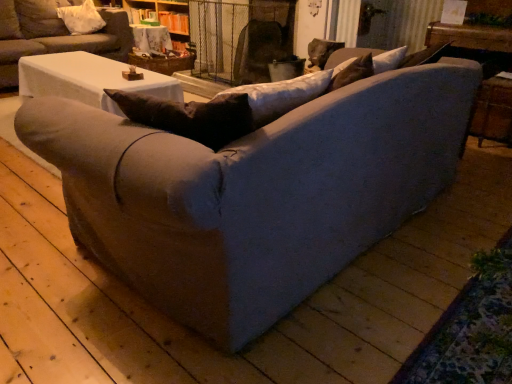
Question: Choose the correct answer: Is textured gray couch at center, which is the first studio couch in bottom-to-top order, inside white fabric pillow at upper left or outside it?

Choices:
 (A) inside
 (B) outside

Answer: (B)

Question: Visually, is textured gray couch at center, the 2th studio couch viewed from the top, positioned to the left or to the right of white fabric pillow at upper left?

Choices:
 (A) left
 (B) right

Answer: (B)

Question: Estimate the real-world distances between objects in this image. Which object is closer to the matte gray couch at center, arranged as the second studio couch when ordered from the bottom?

Choices:
 (A) textured gray couch at center, the 2th studio couch viewed from the top
 (B) white fabric pillow at upper left
 (C) wooden textured table at upper center

Answer: (B)

Question: Which object is positioned farthest from the white fabric pillow at upper left?

Choices:
 (A) matte gray couch at center, arranged as the second studio couch when ordered from the bottom
 (B) wooden textured table at upper center
 (C) textured gray couch at center, the 2th studio couch viewed from the top

Answer: (C)